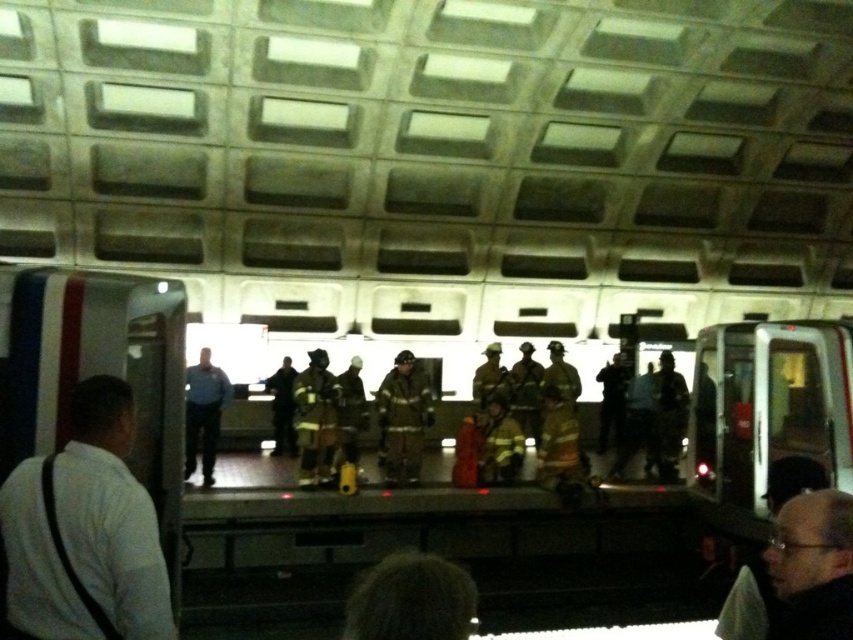
You are a firefighter in the subway station. You need to determine which item is larger between the reflective silver helmet at center and the dark fabric uniform at center. Which one is bigger?

The reflective silver helmet at center is bigger than the dark fabric uniform at center according to the description.

You are a photographer trying to capture a candid shot of the firefighters in the subway station. You notice two key elements in your frame, the smooth black hair at lower right and the dark fabric uniform at center. Which of these elements is closer to the camera based on their positions?

The smooth black hair at lower right is closer to the camera because it is shorter than the dark fabric uniform at center, indicating it is positioned in front.

You are a photographer standing in the subway station. You notice the white shirt at left and the smooth black hair at lower right. Which object would appear larger in your camera viewfinder?

The white shirt at left appears larger in the camera viewfinder because it is bigger than the smooth black hair at lower right.